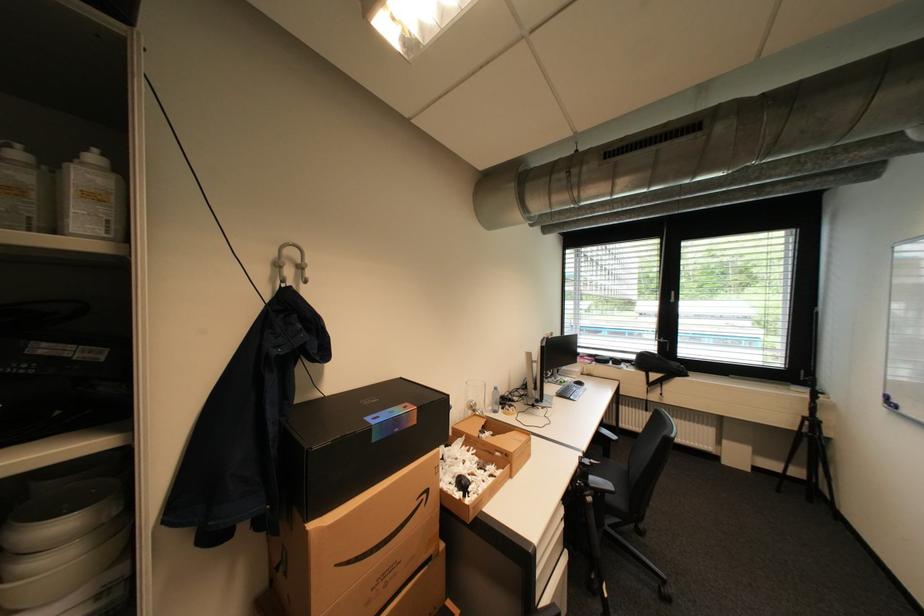
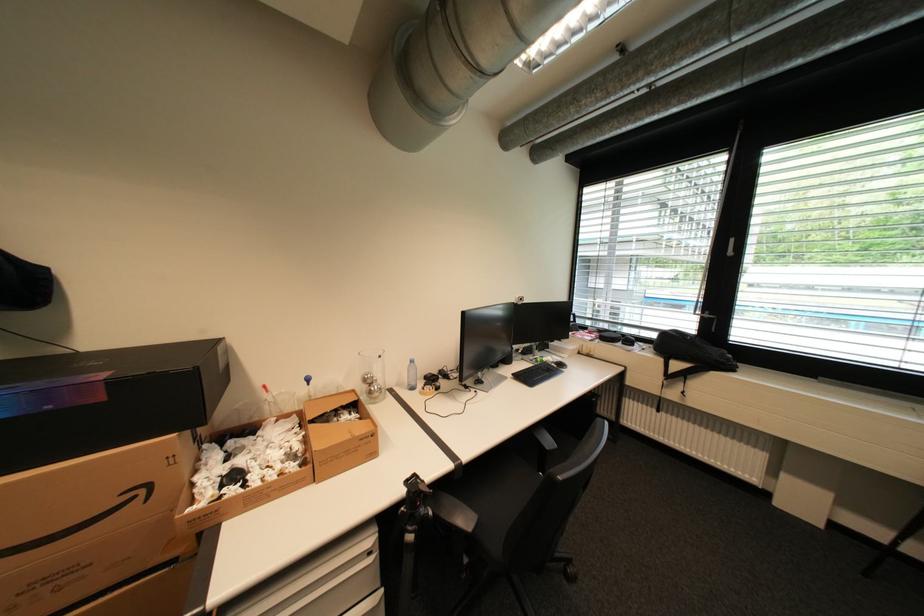
Locate, in the second image, the point that corresponds to (x=659, y=384) in the first image.

(678, 377)